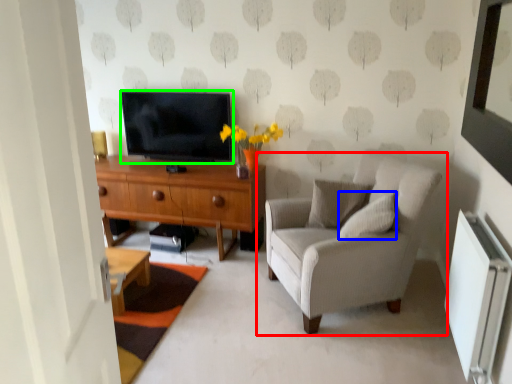
Question: Considering the real-world distances, which object is closest to chair (highlighted by a red box)? pillow (highlighted by a blue box) or television (highlighted by a green box).

Choices:
 (A) pillow
 (B) television

Answer: (A)